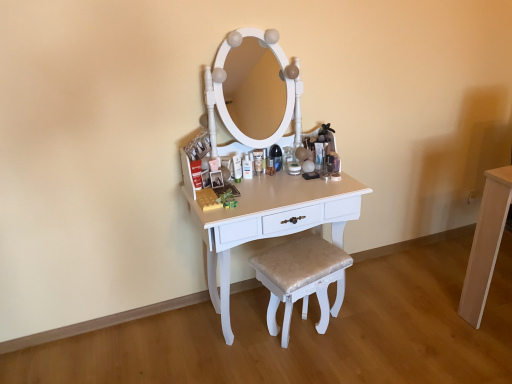
At what (x,y) coordinates should I click in order to perform the action: click on free space in front of matte white lotion at center. Please return your answer as a coordinate pair (x, y). The height and width of the screenshot is (384, 512). Looking at the image, I should click on (240, 196).